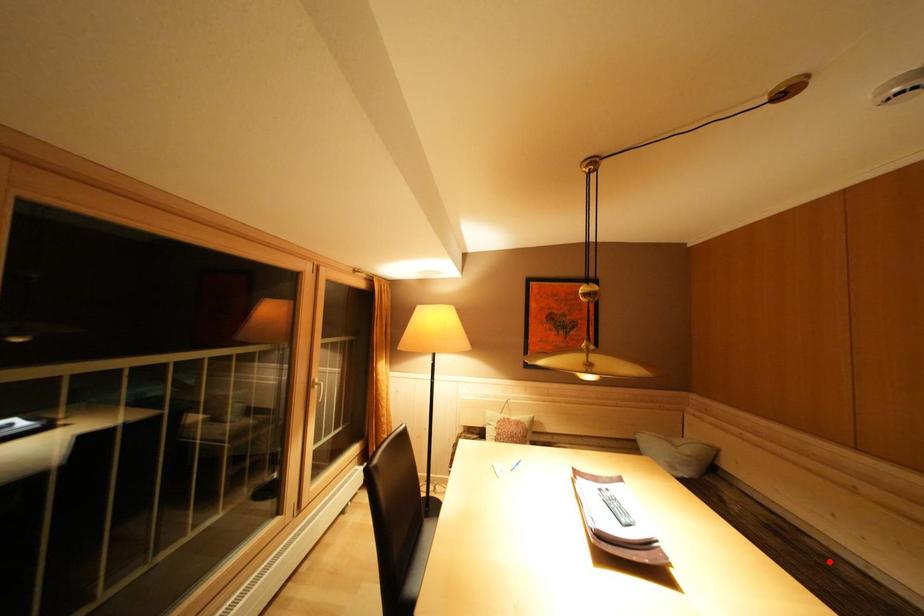
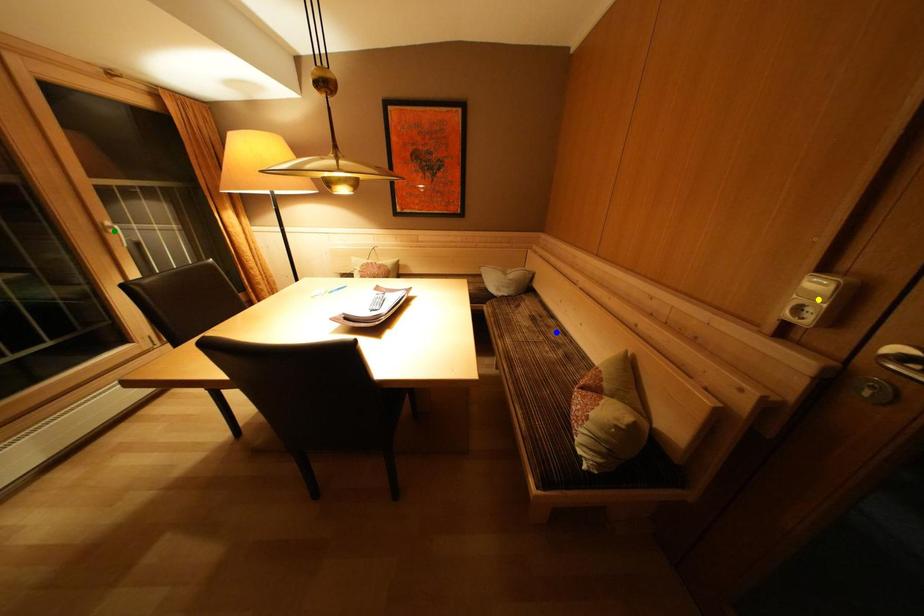
Question: I am providing you with two images of the same scene from different viewpoints. A red point is marked on the first image. You are given multiple points on the second image. Which point in image 2 represents the same 3d spot as the red point in image 1?

Choices:
 (A) yellow point
 (B) green point
 (C) blue point

Answer: (C)